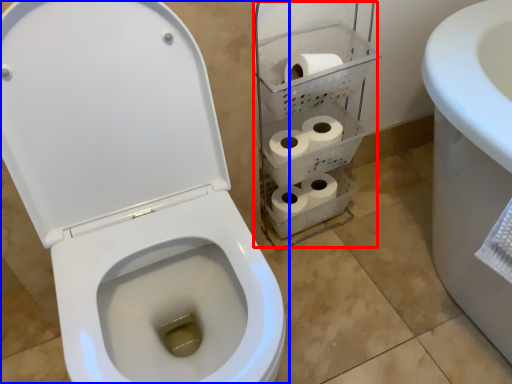
Question: Which object is further to the camera taking this photo, shelf (highlighted by a red box) or toilet (highlighted by a blue box)?

Choices:
 (A) shelf
 (B) toilet

Answer: (A)